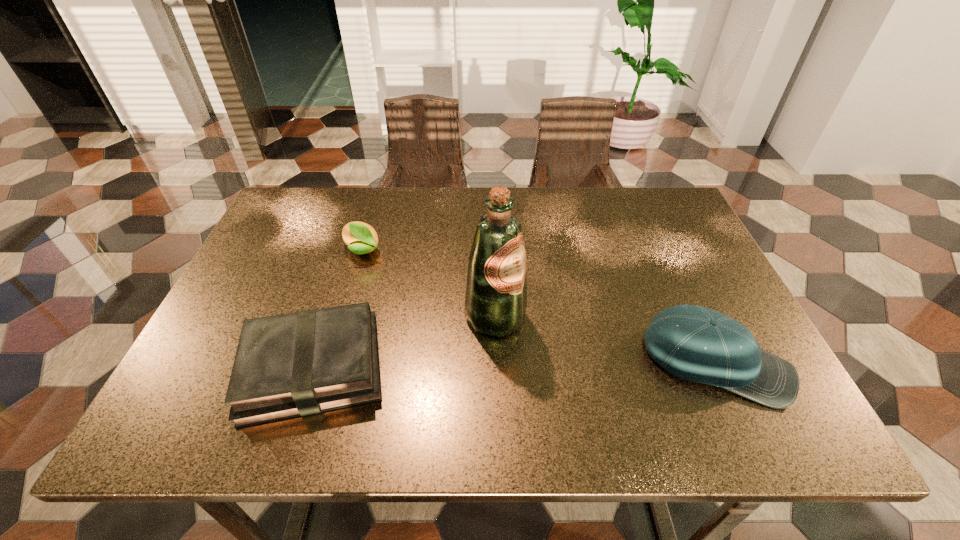
You are a GUI agent. You are given a task and a screenshot of the screen. Output one action in this format:
    pyautogui.click(x=<x>, y=<y>)
    Task: Click on the free space that satisfies the following two spatial constraints: 1. on the back side of the shortest object; 2. on the right side of the lemon
    This screenshot has width=960, height=540.
    Given the screenshot: What is the action you would take?
    pyautogui.click(x=350, y=251)